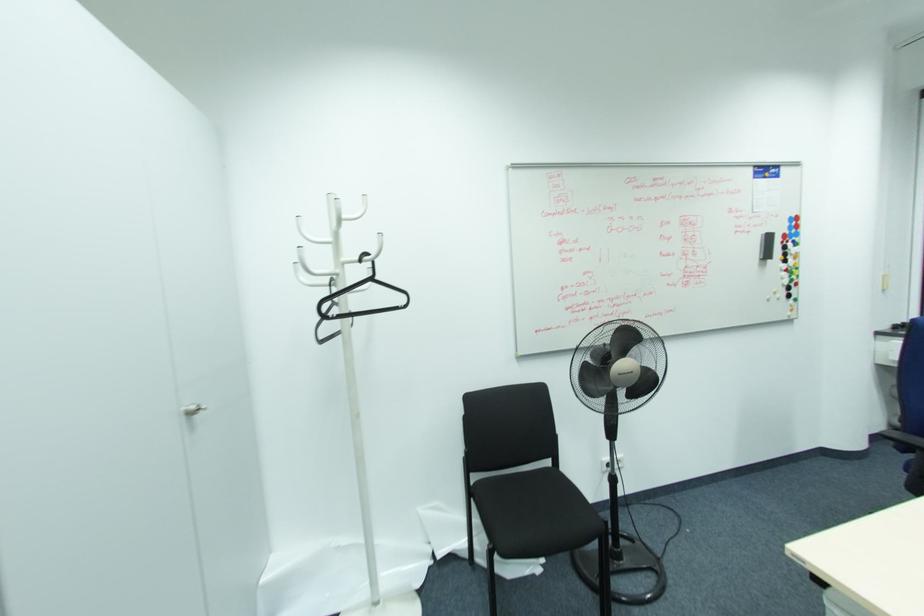
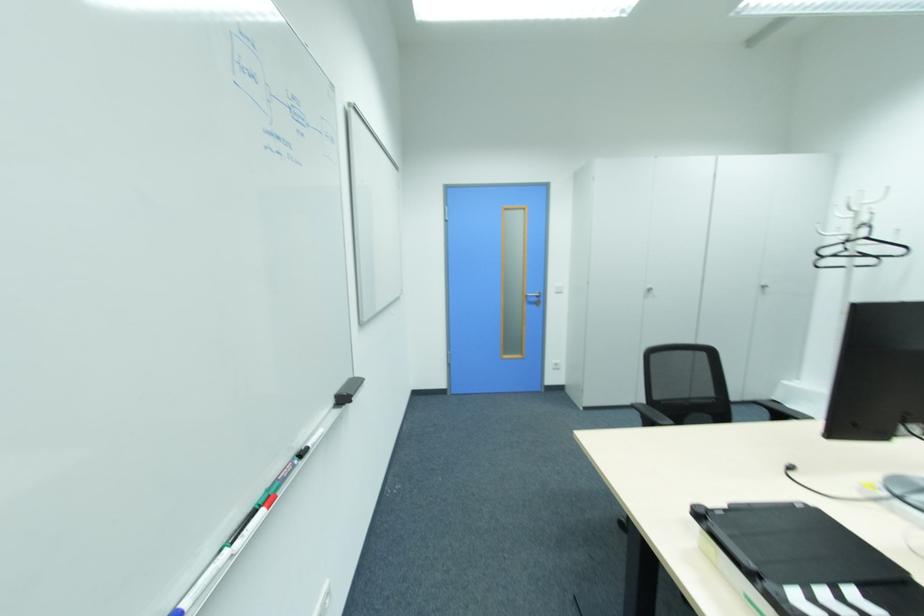
Locate, in the second image, the point that corresponds to point (371, 280) in the first image.

(865, 238)